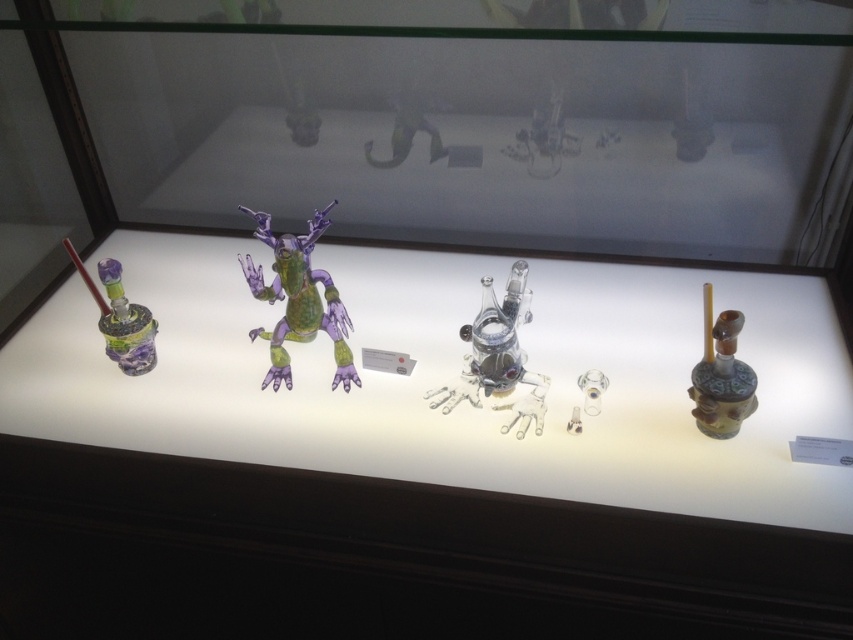
Question: Does translucent purple toy at center appear on the right side of matte green glass pipe at left?

Choices:
 (A) no
 (B) yes

Answer: (B)

Question: Which object is closer to the camera taking this photo?

Choices:
 (A) translucent purple toy at center
 (B) transparent glass frog at center
 (C) matte green glass pipe at left

Answer: (B)

Question: Does translucent purple toy at center appear under transparent glass frog at center?

Choices:
 (A) yes
 (B) no

Answer: (B)

Question: Which object appears closest to the camera in this image?

Choices:
 (A) translucent purple toy at center
 (B) matte green glass pipe at left

Answer: (A)

Question: Based on their relative distances, which object is farther from the transparent glass frog at center?

Choices:
 (A) green matte glass bottle at right
 (B) translucent purple toy at center

Answer: (A)

Question: Is translucent purple toy at center wider than green matte glass bottle at right?

Choices:
 (A) yes
 (B) no

Answer: (A)